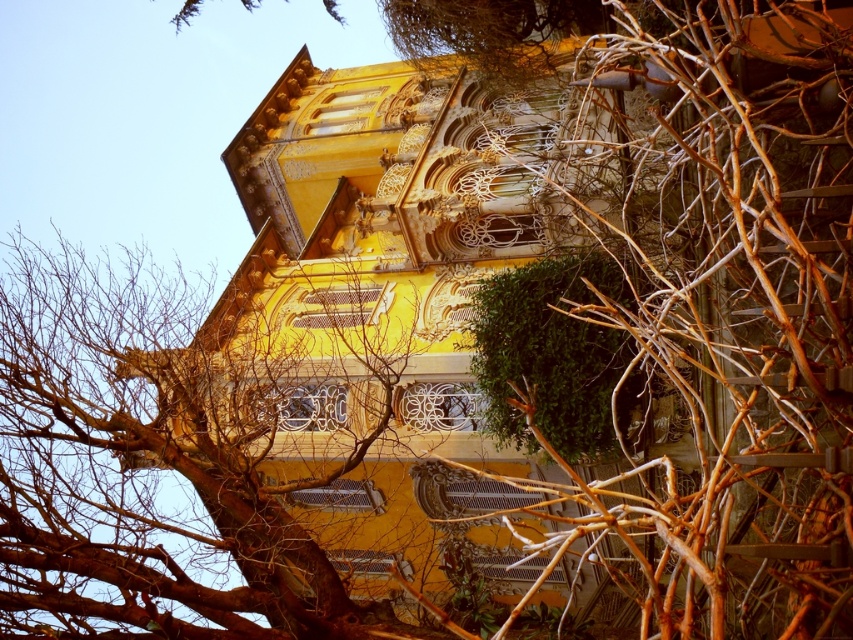
Question: Among these points, which one is farthest from the camera?

Choices:
 (A) (624, 397)
 (B) (688, 372)
 (C) (210, 612)

Answer: (A)

Question: Does brown woody branches at center have a greater width compared to green leafy bush at center?

Choices:
 (A) yes
 (B) no

Answer: (A)

Question: Is brown woody branches at center above green leafy bush at center?

Choices:
 (A) yes
 (B) no

Answer: (A)

Question: Which object is positioned closest to the green leafy bush at center?

Choices:
 (A) brown bark tree at upper left
 (B) brown woody branches at center

Answer: (B)

Question: Is brown woody branches at center thinner than green leafy bush at center?

Choices:
 (A) no
 (B) yes

Answer: (A)

Question: Estimate the real-world distances between objects in this image. Which object is farther from the green leafy bush at center?

Choices:
 (A) brown woody branches at center
 (B) brown bark tree at upper left

Answer: (B)